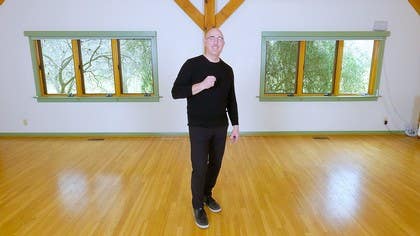
Where is `electrical outlet`? The image size is (420, 236). electrical outlet is located at coordinates (386, 121).